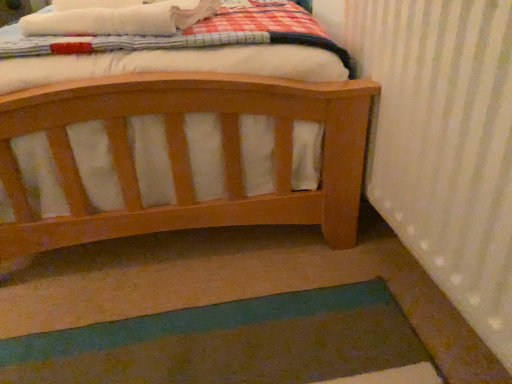
Locate an element on the screen. The width and height of the screenshot is (512, 384). vacant area situated below white textured radiator at right (from a real-world perspective) is located at coordinates (418, 297).